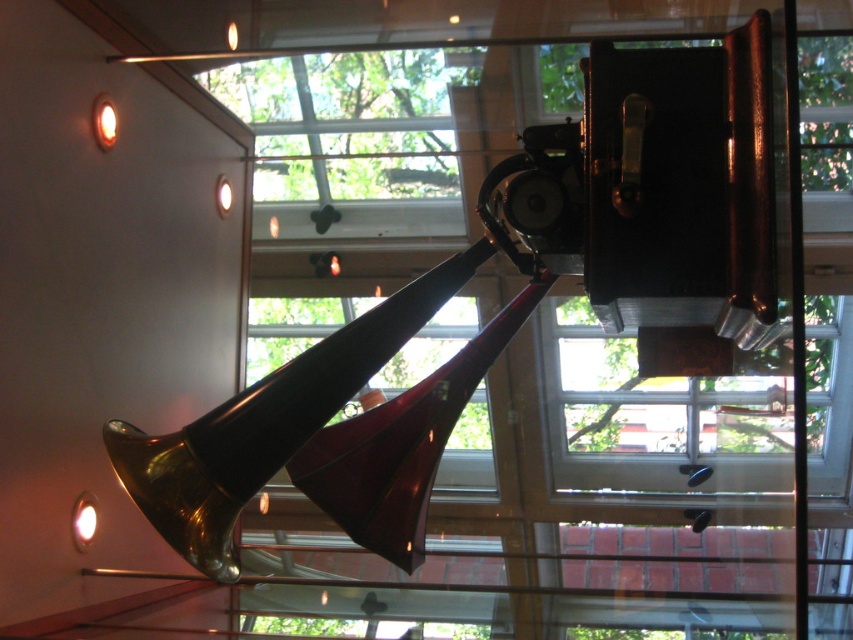
Does transparent glass window at upper center have a smaller size compared to matte gold lamp at lower left?

Actually, transparent glass window at upper center might be larger than matte gold lamp at lower left.

Which is more to the right, transparent glass window at upper center or matte gold lamp at lower left?

Positioned to the right is transparent glass window at upper center.

The width and height of the screenshot is (853, 640). Describe the element at coordinates (548, 352) in the screenshot. I see `transparent glass window at upper center` at that location.

The width and height of the screenshot is (853, 640). I want to click on transparent glass window at upper center, so click(548, 352).

Can you confirm if transparent glass window at center is positioned to the left of matte gold lamp at lower left?

Incorrect, transparent glass window at center is not on the left side of matte gold lamp at lower left.

Is point (267, 301) in front of point (96, 522)?

No, it is not.

Locate an element on the screen. transparent glass window at center is located at coordinates (293, 326).

Does shiny brass trumpet at center appear over transparent glass window at center?

Correct, shiny brass trumpet at center is located above transparent glass window at center.

Does shiny brass trumpet at center appear on the right side of transparent glass window at center?

Yes, shiny brass trumpet at center is to the right of transparent glass window at center.

Between point (425, 305) and point (476, 448), which one is positioned behind?

Point (476, 448)

This screenshot has width=853, height=640. What are the coordinates of `shiny brass trumpet at center` in the screenshot? It's located at (267, 422).